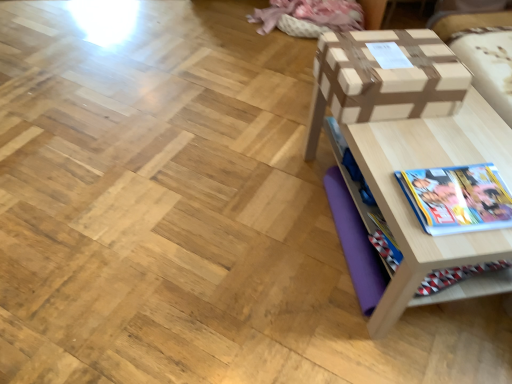
Question: Is brown cardboard box at upper right turned away from wooden table at right?

Choices:
 (A) yes
 (B) no

Answer: (B)

Question: Considering the relative sizes of brown cardboard box at upper right and wooden table at right in the image provided, is brown cardboard box at upper right taller than wooden table at right?

Choices:
 (A) yes
 (B) no

Answer: (B)

Question: From a real-world perspective, is brown cardboard box at upper right on wooden table at right?

Choices:
 (A) no
 (B) yes

Answer: (B)

Question: Is brown cardboard box at upper right to the left of wooden table at right from the viewer's perspective?

Choices:
 (A) no
 (B) yes

Answer: (B)

Question: From the image's perspective, is brown cardboard box at upper right located beneath wooden table at right?

Choices:
 (A) yes
 (B) no

Answer: (B)

Question: From a real-world perspective, is wooden table at right positioned above or below brown cardboard box at upper right?

Choices:
 (A) below
 (B) above

Answer: (A)

Question: Relative to brown cardboard box at upper right, is wooden table at right in front or behind?

Choices:
 (A) behind
 (B) front

Answer: (B)

Question: Which is correct: wooden table at right is inside brown cardboard box at upper right, or outside of it?

Choices:
 (A) outside
 (B) inside

Answer: (A)

Question: Is wooden table at right to the left or to the right of brown cardboard box at upper right in the image?

Choices:
 (A) left
 (B) right

Answer: (B)

Question: From the image's perspective, is hardcover book at lower right above or below brown cardboard box at upper right?

Choices:
 (A) above
 (B) below

Answer: (B)

Question: Is hardcover book at lower right in front of or behind brown cardboard box at upper right in the image?

Choices:
 (A) behind
 (B) front

Answer: (B)

Question: Choose the correct answer: Is hardcover book at lower right inside brown cardboard box at upper right or outside it?

Choices:
 (A) inside
 (B) outside

Answer: (B)

Question: Is hardcover book at lower right bigger or smaller than brown cardboard box at upper right?

Choices:
 (A) small
 (B) big

Answer: (A)

Question: Which is correct: hardcover book at lower right is inside wooden table at right, or outside of it?

Choices:
 (A) inside
 (B) outside

Answer: (A)

Question: Considering the positions of hardcover book at lower right and wooden table at right in the image, is hardcover book at lower right bigger or smaller than wooden table at right?

Choices:
 (A) big
 (B) small

Answer: (B)